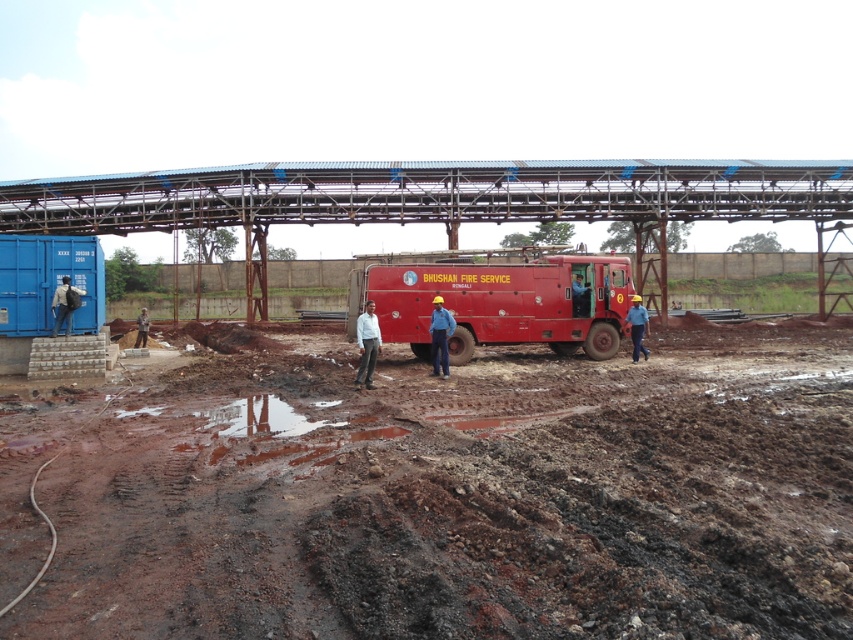
Question: Which point is farther from the camera taking this photo?

Choices:
 (A) (431, 339)
 (B) (393, 275)
 (C) (143, 308)

Answer: (C)

Question: Which of these objects is positioned farthest from the white matte shirt at center?

Choices:
 (A) dark blue uniform at left
 (B) red matte fire truck at center

Answer: (A)

Question: Does red matte fire truck at center have a lesser width compared to light brown wooden pole at center?

Choices:
 (A) no
 (B) yes

Answer: (B)

Question: Is red matte fire truck at center thinner than dark blue uniform at left?

Choices:
 (A) yes
 (B) no

Answer: (B)

Question: Can you confirm if white matte shirt at center is positioned below matte blue uniform at center?

Choices:
 (A) yes
 (B) no

Answer: (A)

Question: Estimate the real-world distances between objects in this image. Which object is farther from the matte blue uniform at center?

Choices:
 (A) dark blue uniform at left
 (B) white matte shirt at center

Answer: (A)